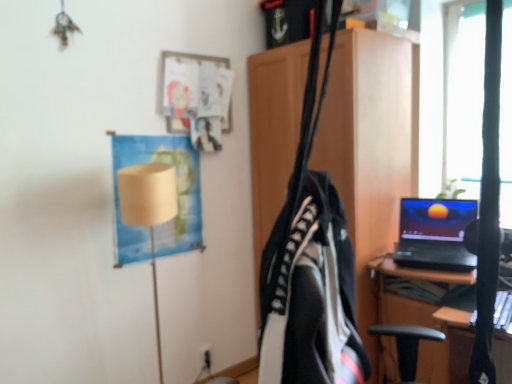
Question: Is black plastic electric outlet at lower center in front of beige paper lampshade at upper left?

Choices:
 (A) yes
 (B) no

Answer: (B)

Question: From the image's perspective, is black plastic electric outlet at lower center on top of beige paper lampshade at upper left?

Choices:
 (A) yes
 (B) no

Answer: (B)

Question: Can you confirm if black plastic electric outlet at lower center is positioned to the right of beige paper lampshade at upper left?

Choices:
 (A) no
 (B) yes

Answer: (B)

Question: Is black plastic electric outlet at lower center wider than beige paper lampshade at upper left?

Choices:
 (A) yes
 (B) no

Answer: (B)

Question: Can you confirm if black plastic electric outlet at lower center is taller than beige paper lampshade at upper left?

Choices:
 (A) yes
 (B) no

Answer: (B)

Question: Are black plastic electric outlet at lower center and beige paper lampshade at upper left located far from each other?

Choices:
 (A) no
 (B) yes

Answer: (A)

Question: From a real-world perspective, is beige paper lampshade at upper left located higher than black fabric bag at center?

Choices:
 (A) yes
 (B) no

Answer: (B)

Question: Can you confirm if beige paper lampshade at upper left is shorter than black fabric bag at center?

Choices:
 (A) no
 (B) yes

Answer: (B)

Question: Can you confirm if beige paper lampshade at upper left is smaller than black fabric bag at center?

Choices:
 (A) no
 (B) yes

Answer: (B)

Question: Is black fabric bag at center surrounded by beige paper lampshade at upper left?

Choices:
 (A) no
 (B) yes

Answer: (A)

Question: Can you confirm if beige paper lampshade at upper left is positioned to the left of black fabric bag at center?

Choices:
 (A) yes
 (B) no

Answer: (A)

Question: Is beige paper lampshade at upper left positioned behind black fabric bag at center?

Choices:
 (A) yes
 (B) no

Answer: (A)

Question: Can you confirm if wooden cabinet at center is taller than black plastic electric outlet at lower center?

Choices:
 (A) no
 (B) yes

Answer: (B)